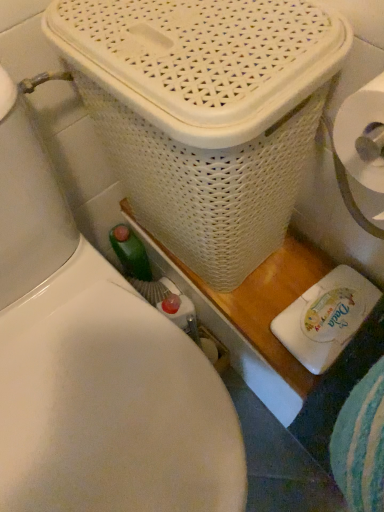
Question: From their relative heights in the image, would you say white plastic toilet at upper center is taller or shorter than white wicker basket at upper center?

Choices:
 (A) short
 (B) tall

Answer: (B)

Question: Relative to white wicker basket at upper center, is white plastic toilet at upper center in front or behind?

Choices:
 (A) behind
 (B) front

Answer: (B)

Question: Based on their sizes in the image, would you say white plastic toilet at upper center is bigger or smaller than white wicker basket at upper center?

Choices:
 (A) big
 (B) small

Answer: (A)

Question: Is white wicker basket at upper center bigger or smaller than white plastic toilet at upper center?

Choices:
 (A) small
 (B) big

Answer: (A)

Question: In terms of width, does white wicker basket at upper center look wider or thinner when compared to white plastic toilet at upper center?

Choices:
 (A) thin
 (B) wide

Answer: (A)

Question: Is white wicker basket at upper center taller or shorter than white plastic toilet at upper center?

Choices:
 (A) tall
 (B) short

Answer: (B)

Question: In the image, is white wicker basket at upper center on the left side or the right side of white plastic toilet at upper center?

Choices:
 (A) left
 (B) right

Answer: (B)